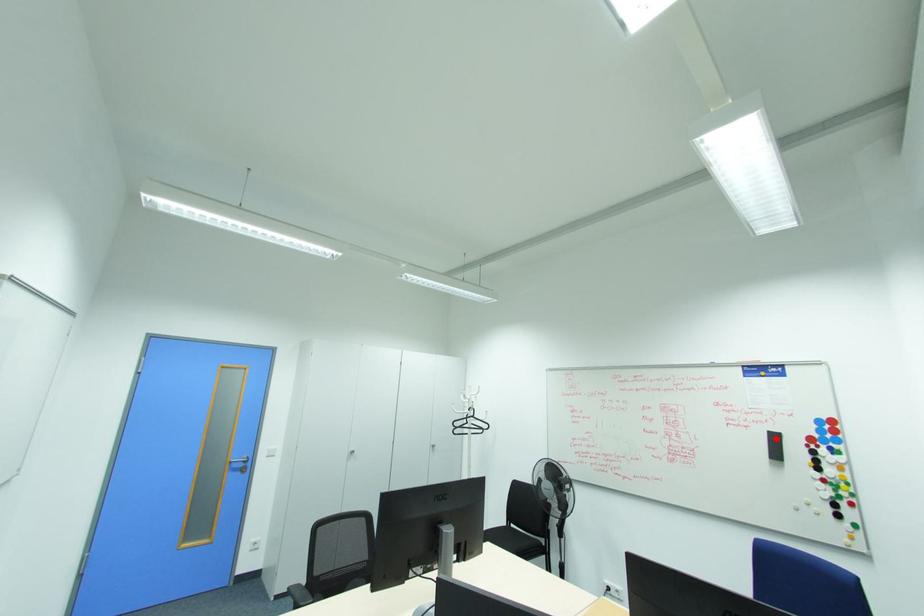
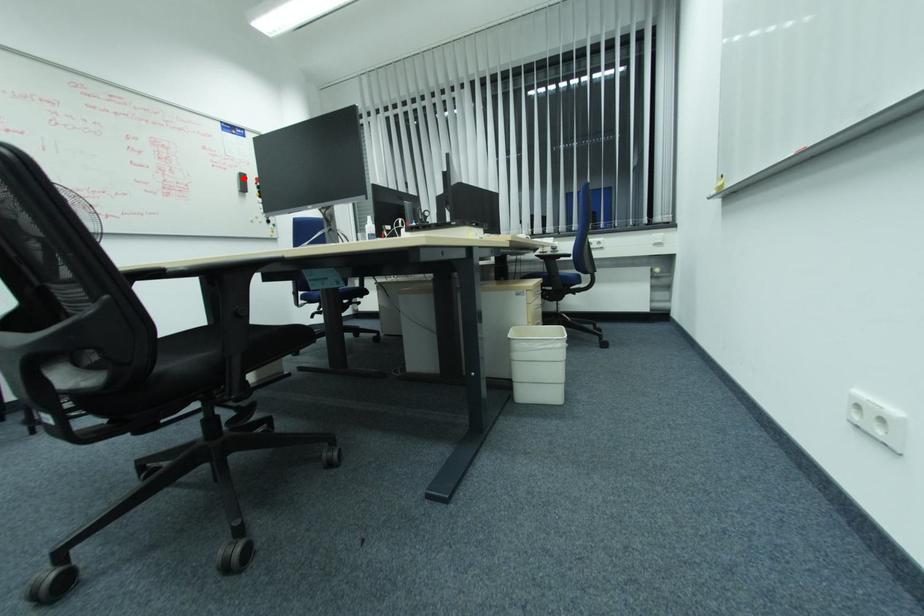
From the picture: I am providing you with two images of the same scene from different viewpoints. A red point is marked on the first image and another point is marked on the second image. Are the points marked in image1 and image2 representing the same 3D position?

Yes